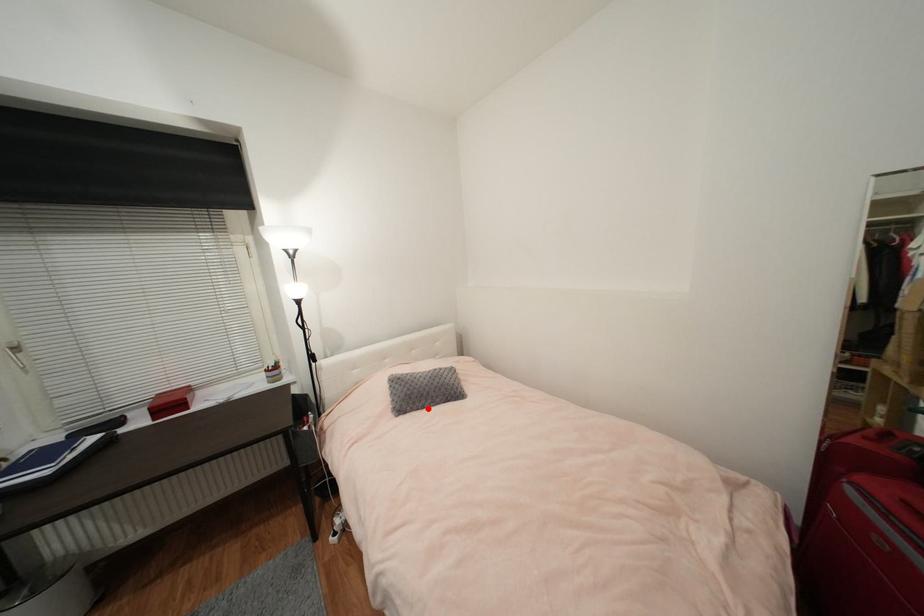
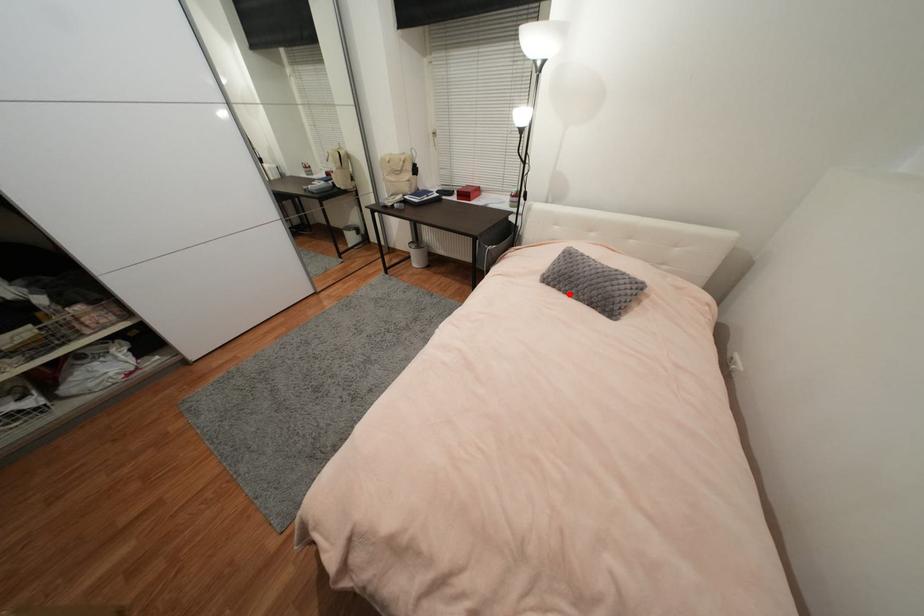
I am providing you with two images of the same scene from different viewpoints. A red point is marked on the first image and another point is marked on the second image. Is the red point in image1 aligned with the point shown in image2?

Yes